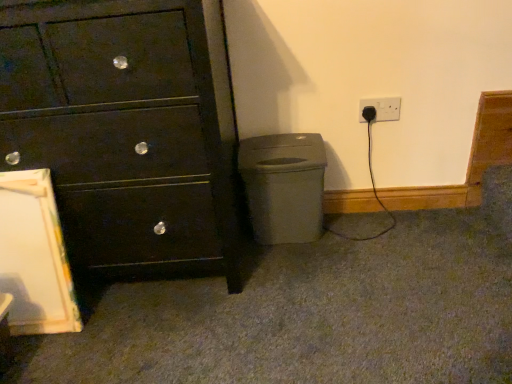
Question: Which is correct: black plastic plug at lower right is inside matte black chest of drawers at left, or outside of it?

Choices:
 (A) outside
 (B) inside

Answer: (A)

Question: Relative to matte black chest of drawers at left, is black plastic plug at lower right in front or behind?

Choices:
 (A) front
 (B) behind

Answer: (B)

Question: Estimate the real-world distances between objects in this image. Which object is farther from the black plastic plug at lower right?

Choices:
 (A) matte gray plastic at lower right
 (B) matte black chest of drawers at left

Answer: (B)

Question: Which of these objects is positioned farthest from the matte gray plastic at lower right?

Choices:
 (A) matte black chest of drawers at left
 (B) black plastic plug at lower right

Answer: (B)